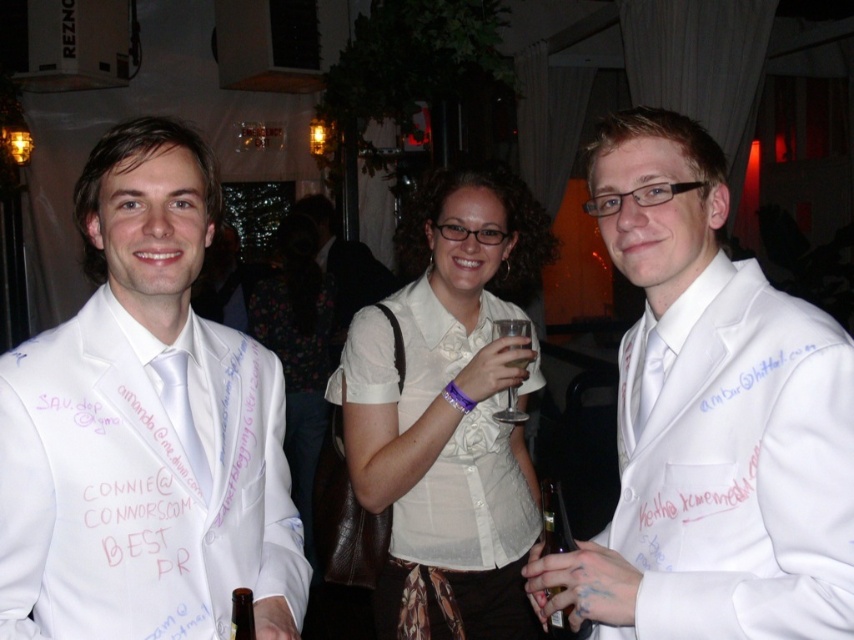
You are a photographer at the event and need to capture a photo that includes both the white satin suit at center and the clear glass wine glass at center. Considering their sizes, which object should be placed closer to the camera to ensure both are clearly visible in the frame?

The clear glass wine glass at center is shorter than the white satin suit at center. To ensure both are clearly visible, place the clear glass wine glass at center closer to the camera since it is smaller and needs to be emphasized in the photo.

You are a photographer at the event and want to capture a closeup of the white satin suit at center without the clear glass wine glass at center appearing in the foreground. Is this possible?

The white satin suit at center is closer to the viewer than the clear glass wine glass at center, so you can focus on the white satin suit at center and the glass will be behind it, not in the foreground.